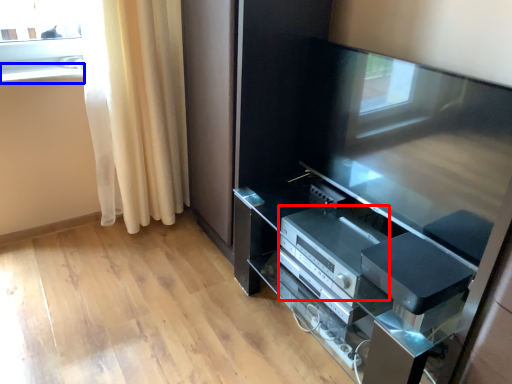
Question: Which point is further to the camera, appliance (highlighted by a red box) or window sill (highlighted by a blue box)?

Choices:
 (A) appliance
 (B) window sill

Answer: (B)